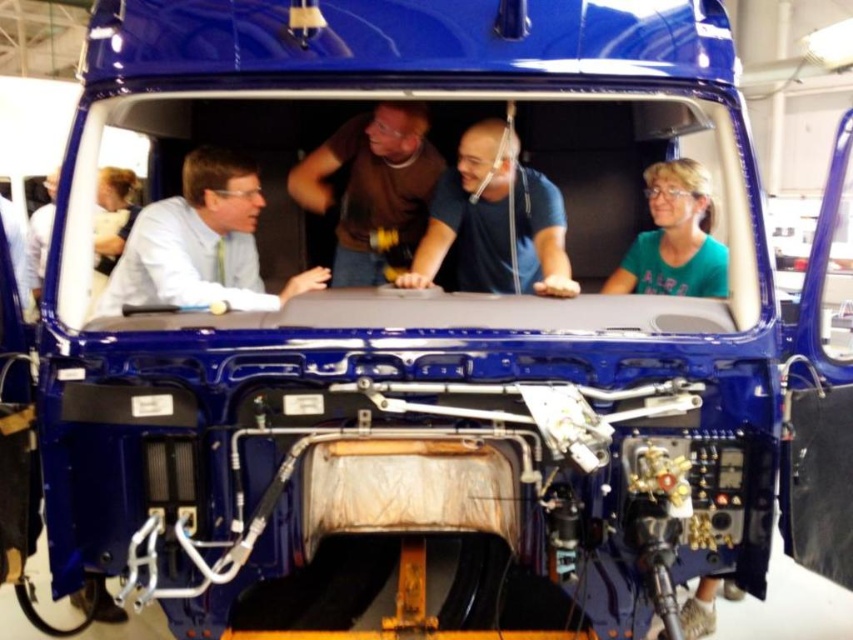
Looking at this image, how far apart are matte white shirt at left and brown cotton shirt at center?

matte white shirt at left is 24.53 inches from brown cotton shirt at center.

Between matte white shirt at left and brown cotton shirt at center, which one is positioned higher?

brown cotton shirt at center

Image resolution: width=853 pixels, height=640 pixels. In order to click on matte white shirt at left in this screenshot , I will do `click(201, 243)`.

Is matte white shirt at left smaller than blue cotton shirt at center?

Yes, matte white shirt at left is smaller than blue cotton shirt at center.

Does matte white shirt at left have a larger size compared to blue cotton shirt at center?

Actually, matte white shirt at left might be smaller than blue cotton shirt at center.

Where is `matte white shirt at left`? matte white shirt at left is located at coordinates (201, 243).

Who is positioned more to the right, matte white shirt at left or green matte shirt at center?

Positioned to the right is green matte shirt at center.

Can you confirm if matte white shirt at left is positioned below green matte shirt at center?

Yes, matte white shirt at left is below green matte shirt at center.

The width and height of the screenshot is (853, 640). Identify the location of matte white shirt at left. (201, 243).